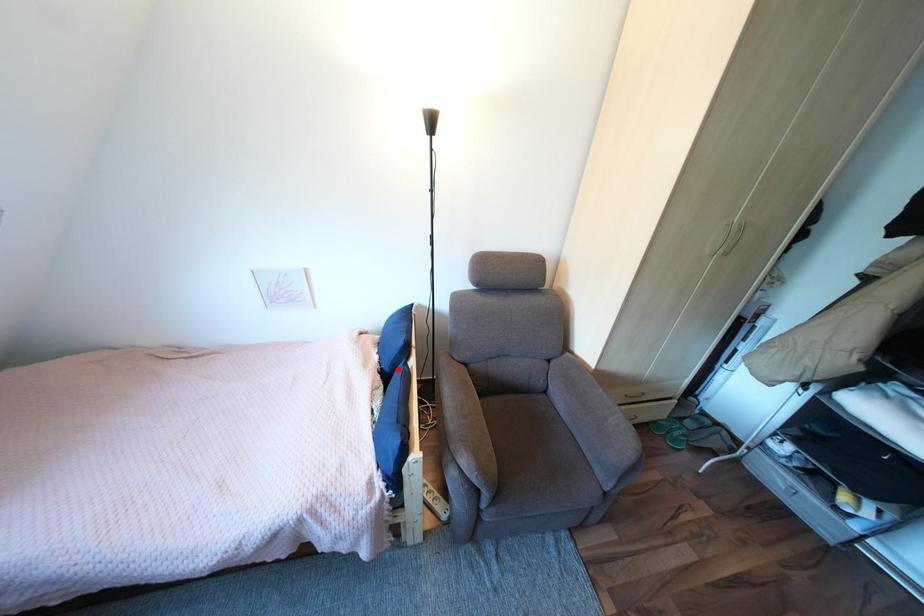
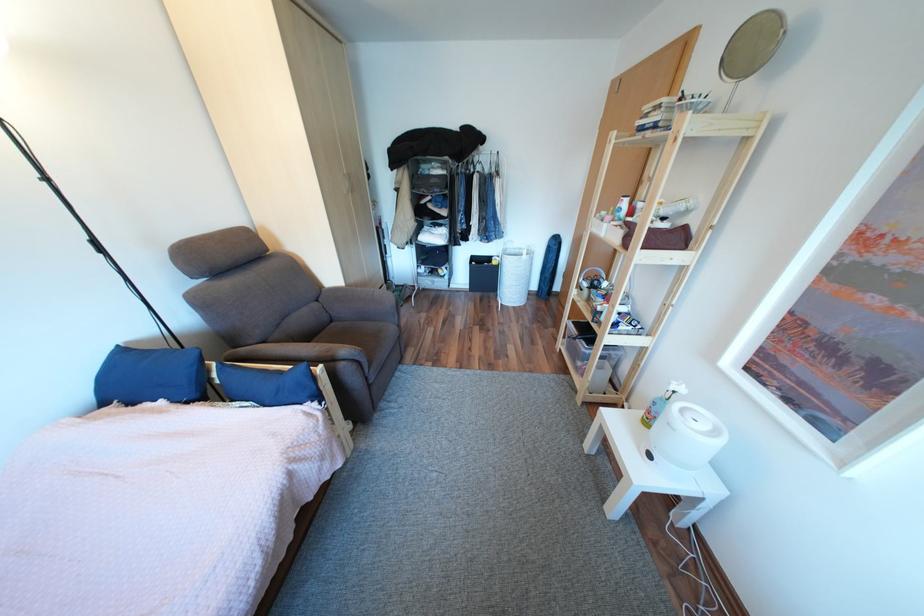
Find the pixel in the second image that matches the highlighted location in the first image.

(205, 395)